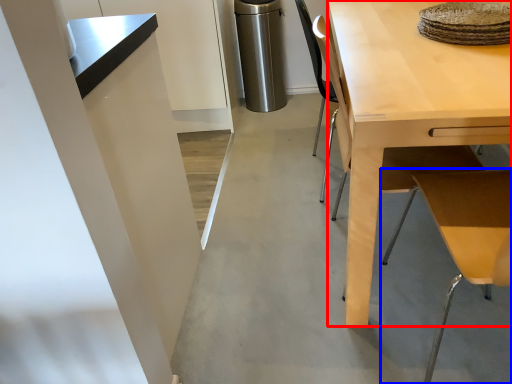
Question: Among these objects, which one is farthest to the camera, desk (highlighted by a red box) or table (highlighted by a blue box)?

Choices:
 (A) desk
 (B) table

Answer: (A)